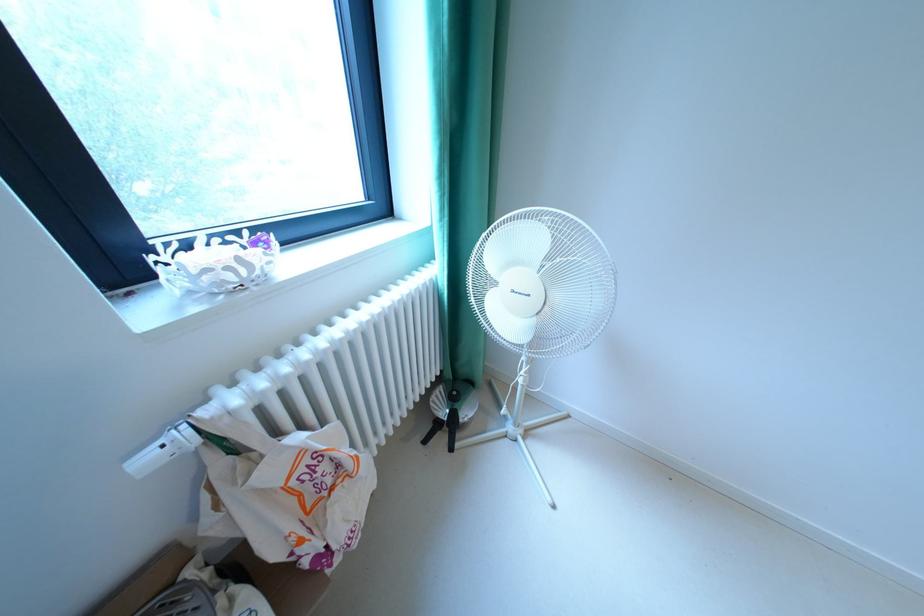
Find where to pull the tote bag handle. Please return your answer as a coordinate pair (x, y).

(216, 440)